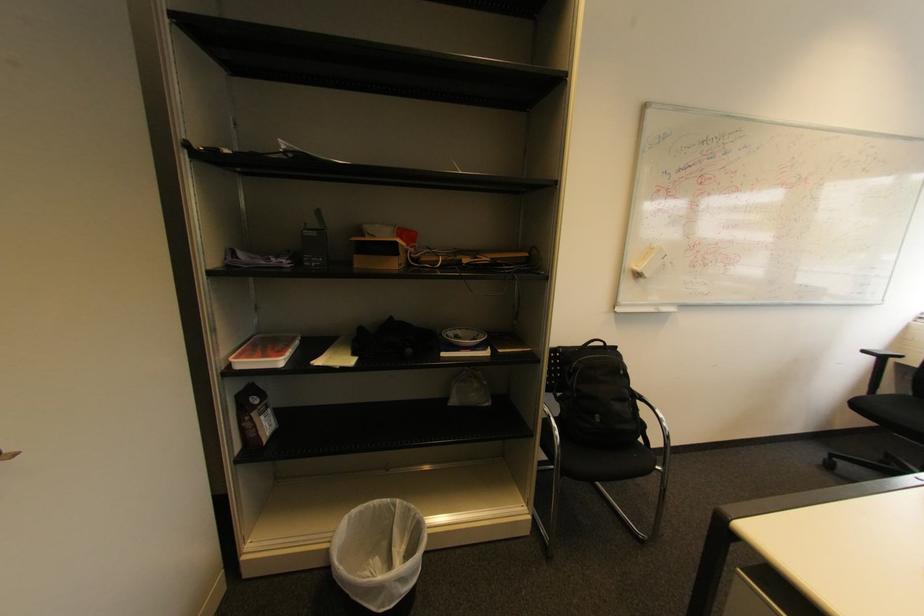
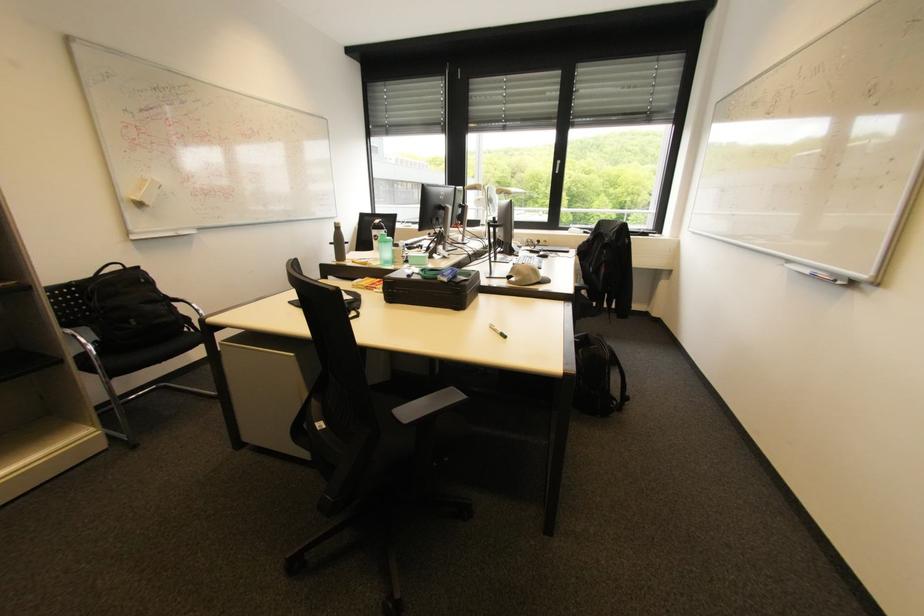
Question: The camera is either moving clockwise (left) or counter-clockwise (right) around the object. The first image is from the beginning of the video and the second image is from the end. Is the camera moving left or right when shooting the video?

Choices:
 (A) Left
 (B) Right

Answer: (A)